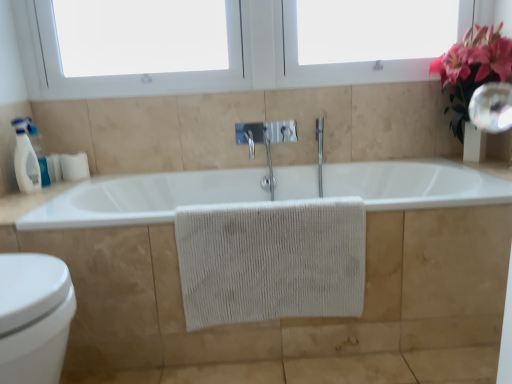
Question: From the image's perspective, is clear glass mirror at upper right on white plastic window at upper center, the first window screen when ordered from left to right?

Choices:
 (A) no
 (B) yes

Answer: (A)

Question: Does clear glass mirror at upper right turn towards white plastic window at upper center, the first window screen when ordered from left to right?

Choices:
 (A) yes
 (B) no

Answer: (A)

Question: Does clear glass mirror at upper right have a smaller size compared to white plastic window at upper center, the first window screen when ordered from left to right?

Choices:
 (A) no
 (B) yes

Answer: (B)

Question: Is clear glass mirror at upper right bigger than white plastic window at upper center, which is the second window screen in right-to-left order?

Choices:
 (A) no
 (B) yes

Answer: (A)

Question: Is clear glass mirror at upper right not near white plastic window at upper center, the first window screen when ordered from left to right?

Choices:
 (A) yes
 (B) no

Answer: (A)

Question: Does clear glass mirror at upper right appear on the left side of white plastic window at upper center, the first window screen when ordered from left to right?

Choices:
 (A) no
 (B) yes

Answer: (A)

Question: Considering the relative sizes of white glossy bidet at lower left and white glossy counter top at lower left in the image provided, is white glossy bidet at lower left wider than white glossy counter top at lower left?

Choices:
 (A) no
 (B) yes

Answer: (A)

Question: Does white glossy bidet at lower left have a smaller size compared to white glossy counter top at lower left?

Choices:
 (A) no
 (B) yes

Answer: (A)

Question: Is white glossy bidet at lower left aimed at white glossy counter top at lower left?

Choices:
 (A) no
 (B) yes

Answer: (A)

Question: Is white glossy bidet at lower left completely or partially outside of white glossy counter top at lower left?

Choices:
 (A) no
 (B) yes

Answer: (B)

Question: Is white glossy bidet at lower left closer to the viewer compared to white glossy counter top at lower left?

Choices:
 (A) no
 (B) yes

Answer: (B)

Question: Is white glossy bidet at lower left at the right side of white glossy counter top at lower left?

Choices:
 (A) no
 (B) yes

Answer: (B)

Question: Is white matte bathtub at center bigger than white glossy bidet at lower left?

Choices:
 (A) no
 (B) yes

Answer: (B)